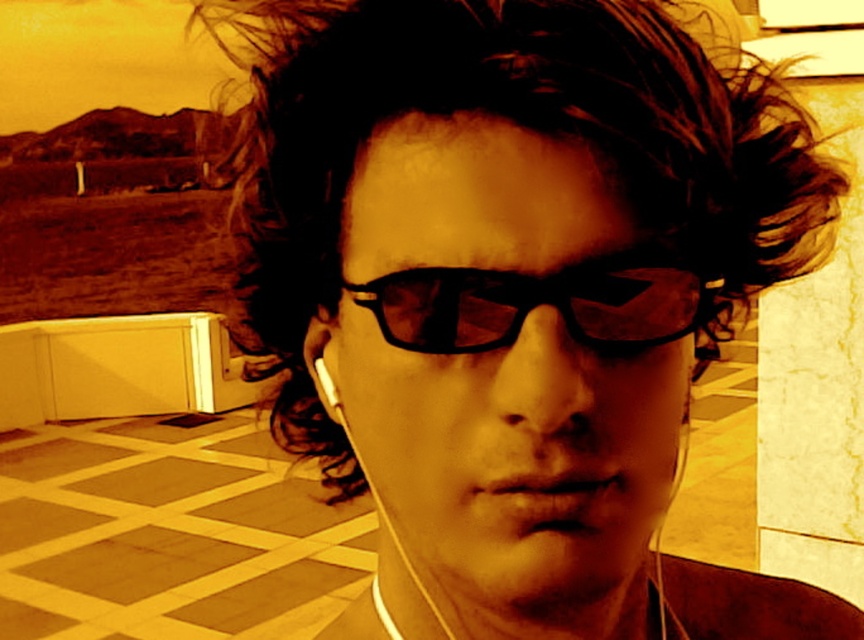
You are a photographer trying to capture a close shot of the dark brown curly hair at center. Your camera lens has a minimum focusing distance of 12 inches. Can you take the photo without moving closer?

The dark brown curly hair at center and viewer are 12.50 inches apart from each other. Since the minimum focusing distance is 12 inches, the photographer can take the photo without moving closer because the distance is sufficient.

You are a photographer adjusting the focus of your camera. You notice the dark brown curly hair at center and the black matte earphone at center in your viewfinder. Which object is closer to the camera lens?

The dark brown curly hair at center is in front of the black matte earphone at center, so it is closer to the camera lens.

You are a photographer trying to capture the perfect shot of the dark brown curly hair at center and the black matte glasses at center. Based on their sizes, which object should you focus on first if you want both to be in sharp focus?

A: The dark brown curly hair at center is larger in size than the black matte glasses at center, so you should focus on the dark brown curly hair at center first to ensure both are in sharp focus.